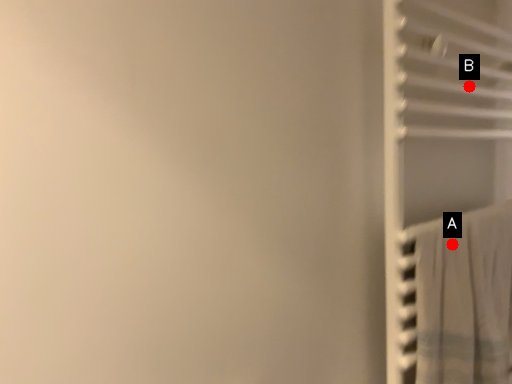
Question: Two points are circled on the image, labeled by A and B beside each circle. Which point is closer to the camera?

Choices:
 (A) A is closer
 (B) B is closer

Answer: (A)